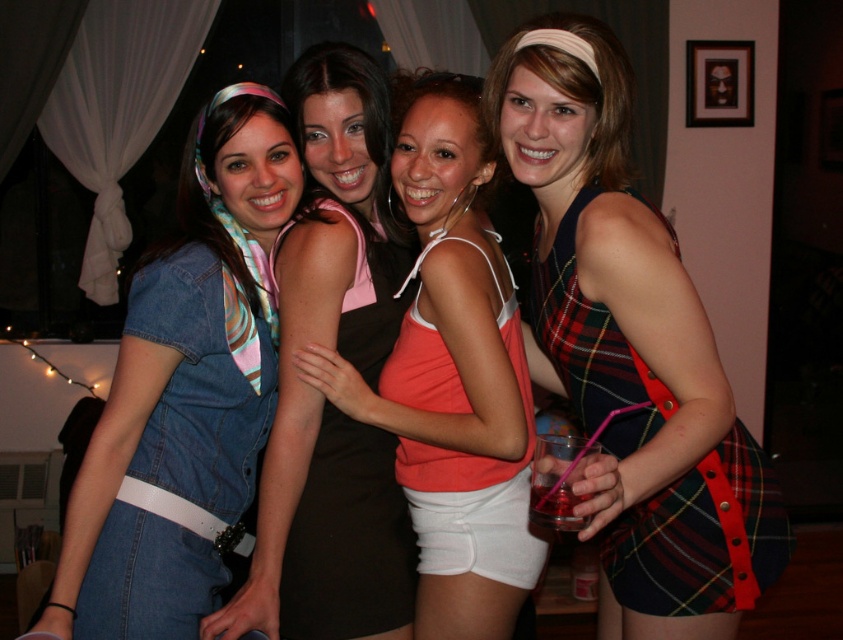
Is plaid fabric dress at right below black satin dress at center?

No.

Is point (589, 344) positioned in front of point (360, 448)?

Yes.

This screenshot has width=843, height=640. I want to click on plaid fabric dress at right, so click(701, 536).

Who is higher up, denim vest at center or plaid fabric dress at right?

denim vest at center

Who is positioned more to the left, denim vest at center or plaid fabric dress at right?

From the viewer's perspective, denim vest at center appears more on the left side.

Who is more distant from viewer, (341, 61) or (562, 372)?

Point (562, 372)

Identify the location of denim vest at center. The image size is (843, 640). (321, 394).

Is point (392, 330) positioned after point (403, 332)?

That is True.

Which is more to the right, denim vest at center or orange cotton tank top at center?

From the viewer's perspective, orange cotton tank top at center appears more on the right side.

Does point (309, 454) come in front of point (420, 108)?

No, (309, 454) is behind (420, 108).

Where is `denim vest at center`? denim vest at center is located at coordinates (321, 394).